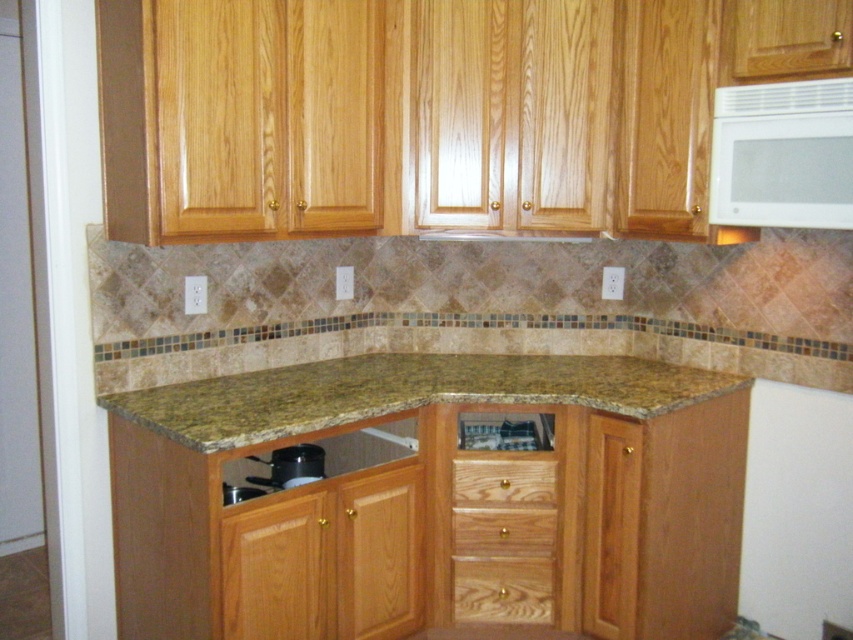
You are organizing the kitchen and need to place a new spice jar. The spice jar requires a spot on the countertop that is not obstructed by the wooden at lower center. Where should you place it?

The wooden at lower center is located at point (502, 589), so you should place the spice jar in an area of the countertop that does not overlap with this coordinate to avoid obstruction.

You are a chef preparing to place a 4.5 inch wide cutting board on the counter. You see the wooden at lower center and the light brown wood drawer at lower center. Is there enough space between them to place the cutting board?

The distance between the wooden at lower center and the light brown wood drawer at lower center is 4.82 inches. Since the cutting board is 4.5 inches wide, it can fit between them as the available space is slightly larger than the board.